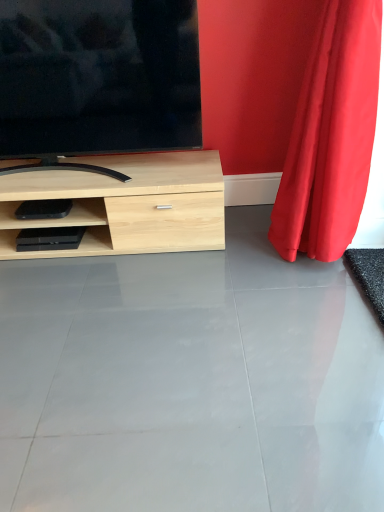
Question: Is gray glossy concrete at center positioned far away from red velvet curtain at right?

Choices:
 (A) yes
 (B) no

Answer: (B)

Question: Does gray glossy concrete at center come behind red velvet curtain at right?

Choices:
 (A) no
 (B) yes

Answer: (A)

Question: Is gray glossy concrete at center smaller than red velvet curtain at right?

Choices:
 (A) yes
 (B) no

Answer: (A)

Question: Is gray glossy concrete at center outside of red velvet curtain at right?

Choices:
 (A) no
 (B) yes

Answer: (B)

Question: Is the position of gray glossy concrete at center less distant than that of red velvet curtain at right?

Choices:
 (A) no
 (B) yes

Answer: (B)

Question: Does gray glossy concrete at center appear on the left side of red velvet curtain at right?

Choices:
 (A) no
 (B) yes

Answer: (B)

Question: Considering the relative positions of gray glossy concrete at center and matte black tv at upper left in the image provided, is gray glossy concrete at center to the left of matte black tv at upper left from the viewer's perspective?

Choices:
 (A) yes
 (B) no

Answer: (B)

Question: Does gray glossy concrete at center have a lesser width compared to matte black tv at upper left?

Choices:
 (A) yes
 (B) no

Answer: (B)

Question: From a real-world perspective, is gray glossy concrete at center beneath matte black tv at upper left?

Choices:
 (A) no
 (B) yes

Answer: (B)

Question: Can matte black tv at upper left be found inside gray glossy concrete at center?

Choices:
 (A) yes
 (B) no

Answer: (B)

Question: Is gray glossy concrete at center taller than matte black tv at upper left?

Choices:
 (A) yes
 (B) no

Answer: (B)

Question: From a real-world perspective, is gray glossy concrete at center on top of matte black tv at upper left?

Choices:
 (A) no
 (B) yes

Answer: (A)

Question: Considering the relative sizes of red velvet curtain at right and matte black tv at upper left in the image provided, is red velvet curtain at right shorter than matte black tv at upper left?

Choices:
 (A) yes
 (B) no

Answer: (B)